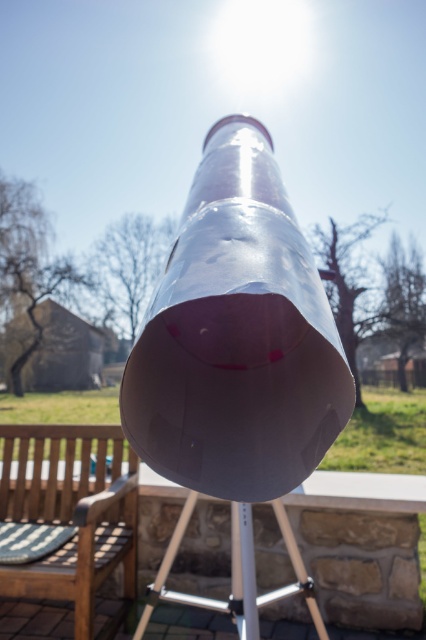
You are planning to host a small gathering and need seating for 6 people. You have a wooden slats bench at lower left and a metallic silver picnic table at center. Which option can accommodate more people?

The wooden slats bench at lower left is bigger than the metallic silver picnic table at center, so it can accommodate more people.

You are a visitor at an outdoor science exhibit and want to sit down near the glossy metallic telescope at center to observe the rocket. Is the wooden slats bench at lower left a good option for you to sit on while still having a clear view of the telescope?

The glossy metallic telescope at center is in front of the wooden slats bench at lower left, so sitting on the bench would place you behind the telescope, blocking your view. Choose another seating area closer to the telescope instead.